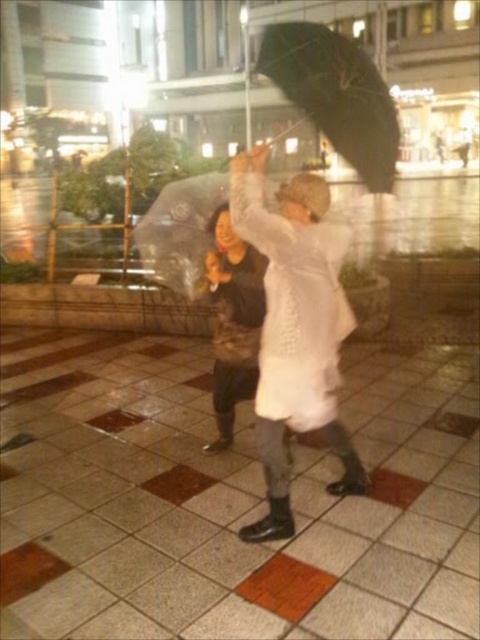
You are a photographer trying to capture both the white matte coat at center and the white matte coat at upper center in a single shot. Which of the two will appear smaller in the photo?

The white matte coat at center will appear smaller in the photo because it occupies less space compared to the white matte coat at upper center.

You are standing at the origin point in the plaza. Where is the white matte coat at center located in relation to you?

The white matte coat at center is located at coordinates approximately 0.516 on the x axis and 0.615 on the y axis relative to your position.

You are a photographer trying to capture a closeup shot of the black matte umbrella at upper center and the white matte coat at upper center. If your camera can only focus on one object at a time, which object should you choose to ensure the entire width of the subject fits within the frame?

The black matte umbrella at upper center has a larger width than the white matte coat at upper center. Therefore, to ensure the entire width of the subject fits within the frame, you should focus on the black matte umbrella at upper center.